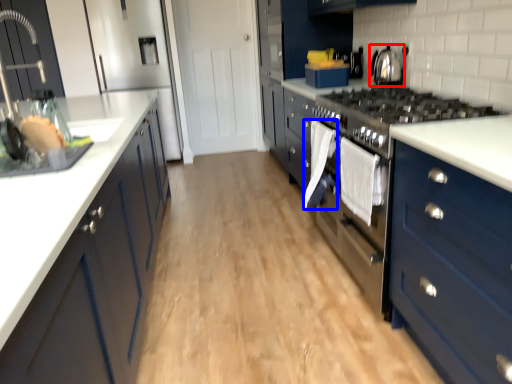
Question: Among these objects, which one is nearest to the camera, home appliance (highlighted by a red box) or clothe (highlighted by a blue box)?

Choices:
 (A) home appliance
 (B) clothe

Answer: (B)